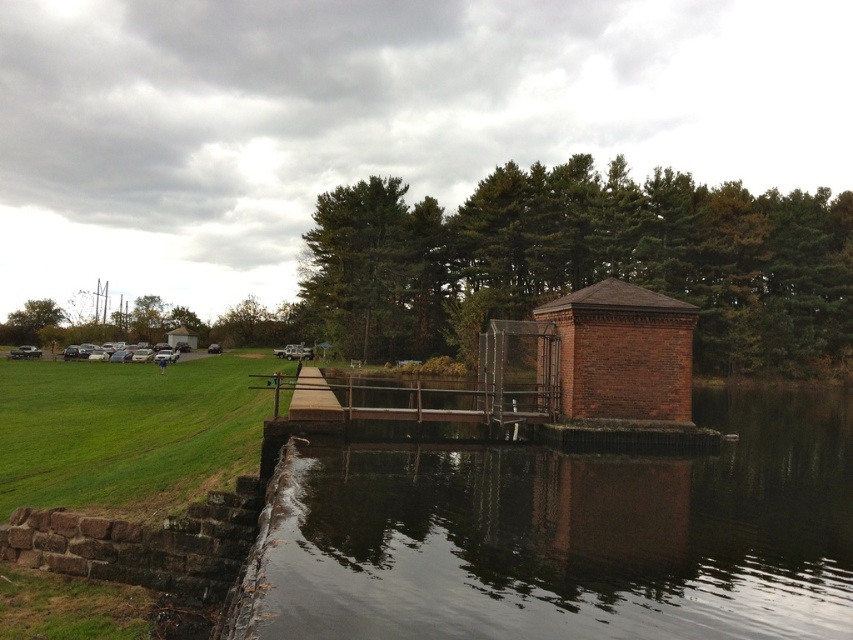
You are standing at the point marked at coordinate point [706,570] and want to reach the small brick structure on the platform. Given that the walkway is only 2 feet wide, can you safely walk to the structure without crossing the edge?

The distance between you at point [706,570] and the small brick structure is 25.02 feet. Since the walkway is 2 feet wide, you can safely walk towards the structure as long as you stay within the walkway boundaries. The width is sufficient for a person to walk without crossing the edge.

You are standing on the wooden walkway and want to take a photo of the brick gazebo at center. However, you notice the dark reflective water at center is blocking your view. Can you move to the left or right to avoid the water and still see the gazebo?

Since the dark reflective water at center is closer to the viewer than the brick gazebo at center, moving to the left or right along the walkway would allow you to bypass the water and still have a clear view of the gazebo.